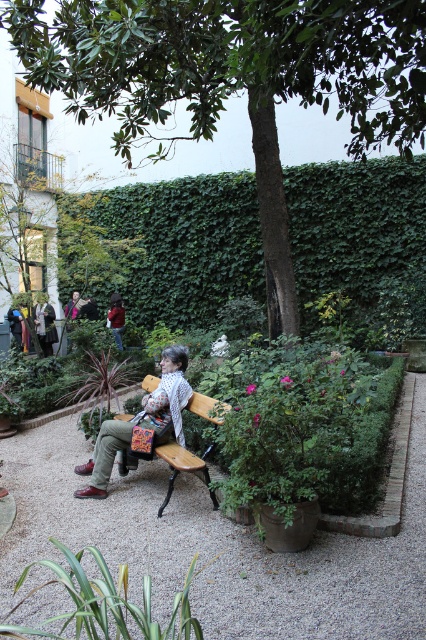
Can you confirm if green ivy hedge at center is shorter than wooden bench at center?

No, green ivy hedge at center is not shorter than wooden bench at center.

Is point (186, 282) positioned before point (207, 401)?

No, (186, 282) is behind (207, 401).

This screenshot has width=426, height=640. In order to click on green ivy hedge at center in this screenshot , I will do [x=166, y=246].

At what (x,y) coordinates should I click in order to perform the action: click on green ivy hedge at center. Please return your answer as a coordinate pair (x, y). Image resolution: width=426 pixels, height=640 pixels. Looking at the image, I should click on (166, 246).

Locate an element on the screen. The height and width of the screenshot is (640, 426). green ivy hedge at center is located at coordinates (166, 246).

Who is positioned more to the right, green ivy hedge at center or matte brown leather jacket at center?

green ivy hedge at center

Which is in front, point (63, 269) or point (161, 438)?

Point (161, 438) is more forward.

In order to click on green ivy hedge at center in this screenshot , I will do `click(166, 246)`.

Image resolution: width=426 pixels, height=640 pixels. Describe the element at coordinates (141, 420) in the screenshot. I see `matte brown leather jacket at center` at that location.

Does matte brown leather jacket at center have a greater height compared to wooden bench at center?

Correct, matte brown leather jacket at center is much taller as wooden bench at center.

Between point (103, 490) and point (190, 461), which one is positioned behind?

The point (103, 490) is behind.

Locate an element on the screen. matte brown leather jacket at center is located at coordinates (141, 420).